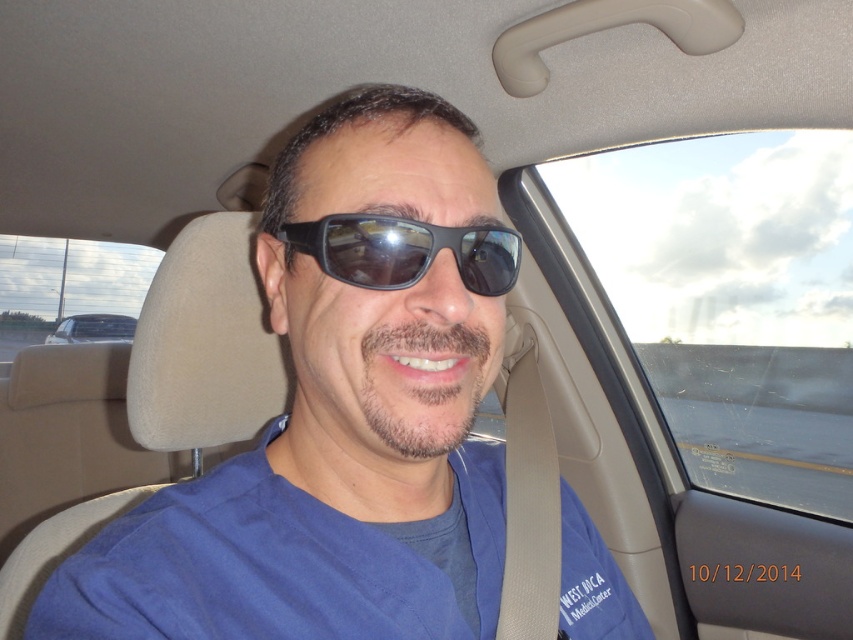
You are a photographer trying to capture a clear photo of the blue fabric shirt at center. However, the matte black sunglasses at center is blocking the view. Can you adjust the angle to avoid the sunglasses?

The matte black sunglasses at center is in front of the blue fabric shirt at center, so you can move the camera slightly to the side to capture the shirt without the sunglasses blocking the view.